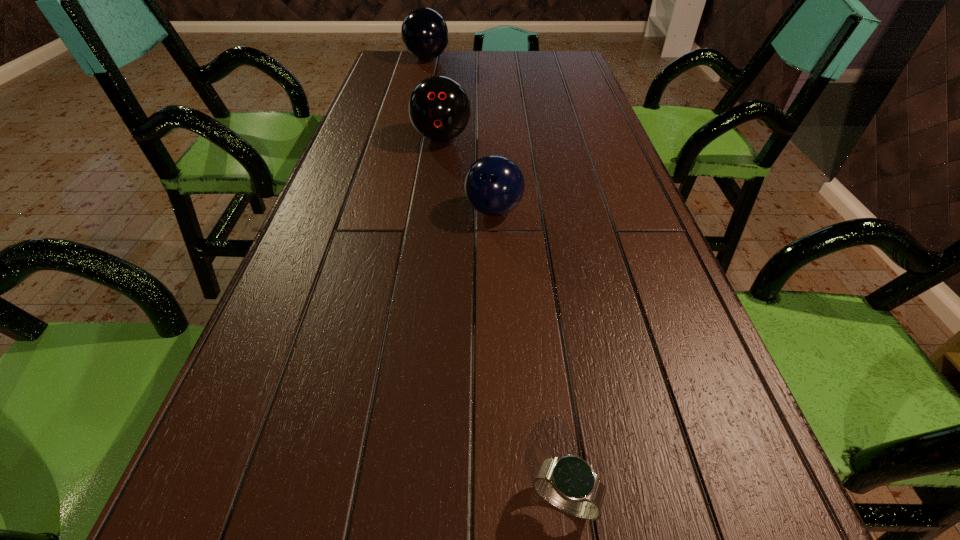
At what (x,y) coordinates should I click in order to perform the action: click on empty location between the watch and the second farthest bowling ball. Please return your answer as a coordinate pair (x, y). Looking at the image, I should click on (503, 320).

Locate an element on the screen. The image size is (960, 540). vacant space in between the third farthest object and the shortest object is located at coordinates coord(529,356).

I want to click on vacant area that lies between the nearest bowling ball and the farthest bowling ball, so click(460, 135).

I want to click on unoccupied position between the third nearest object and the watch, so click(503, 320).

The width and height of the screenshot is (960, 540). In order to click on vacant area that lies between the shortest bowling ball and the farthest object in this screenshot , I will do `click(460, 135)`.

The width and height of the screenshot is (960, 540). Identify the location of the closest object to the watch. (494, 185).

Identify the location of object that is the third closest to the third tallest object. The width and height of the screenshot is (960, 540). (424, 32).

Image resolution: width=960 pixels, height=540 pixels. Find the location of `bowling ball that can be found as the second closest to the third nearest object`. bowling ball that can be found as the second closest to the third nearest object is located at coordinates click(424, 32).

Locate an element on the screen. This screenshot has width=960, height=540. the second closest bowling ball relative to the third nearest object is located at coordinates (424, 32).

At what (x,y) coordinates should I click in order to perform the action: click on free spot that satisfies the following two spatial constraints: 1. on the side of the farthest object with the finger holes; 2. on the left side of the shortest object. Please return your answer as a coordinate pair (x, y). Looking at the image, I should click on (322, 502).